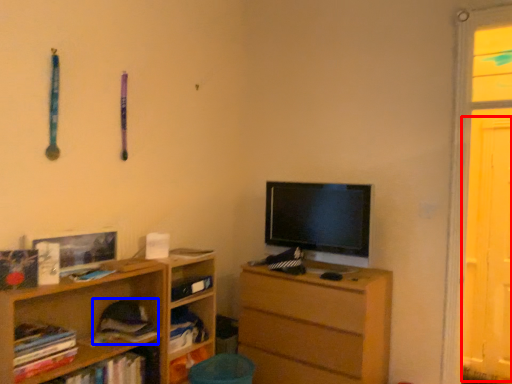
Question: Among these objects, which one is nearest to the camera, screen door (highlighted by a red box) or book (highlighted by a blue box)?

Choices:
 (A) screen door
 (B) book

Answer: (B)